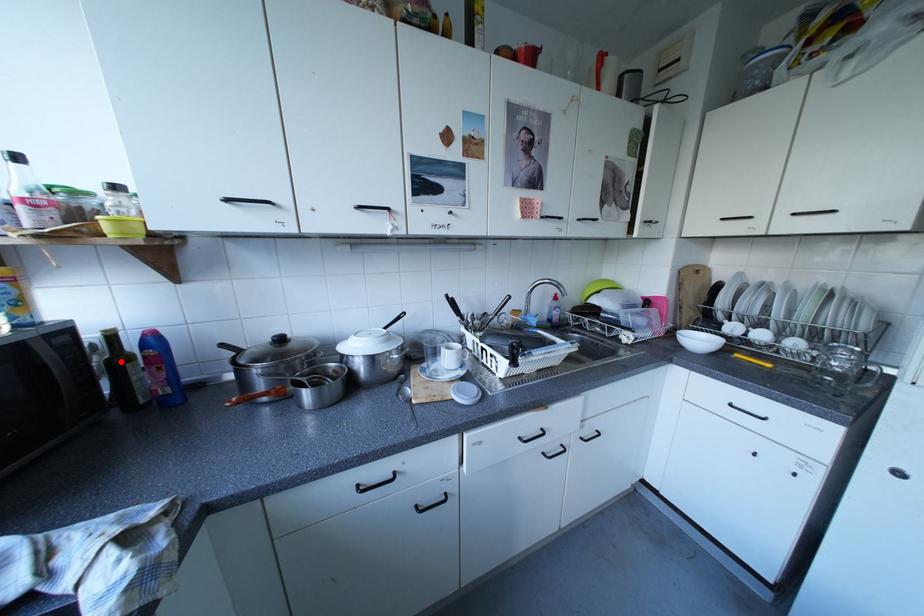
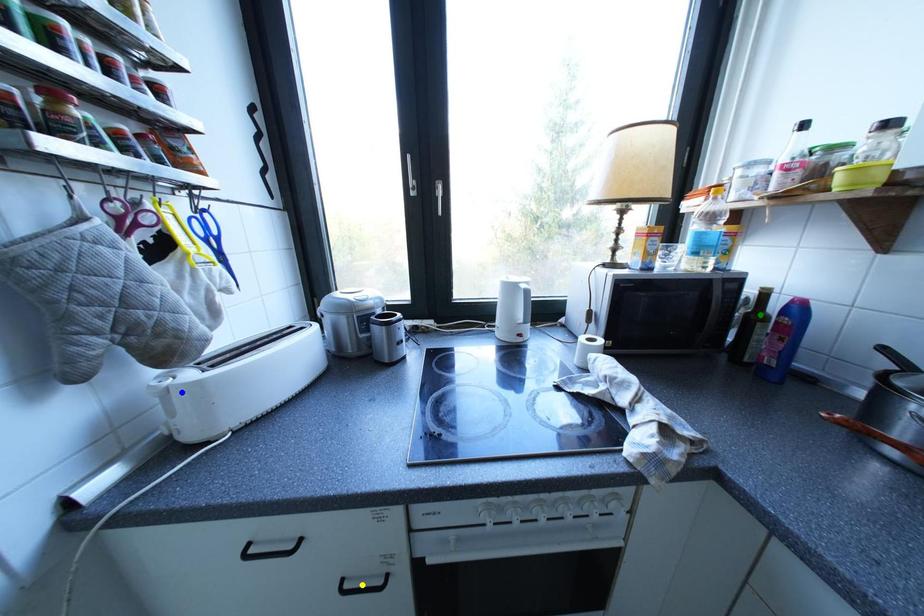
Question: I am providing you with two images of the same scene from different viewpoints. A red point is marked on the first image. You are given multiple points on the second image. Can you choose the point in image 2 that corresponds to the point in image 1?

Choices:
 (A) green point
 (B) blue point
 (C) yellow point

Answer: (A)